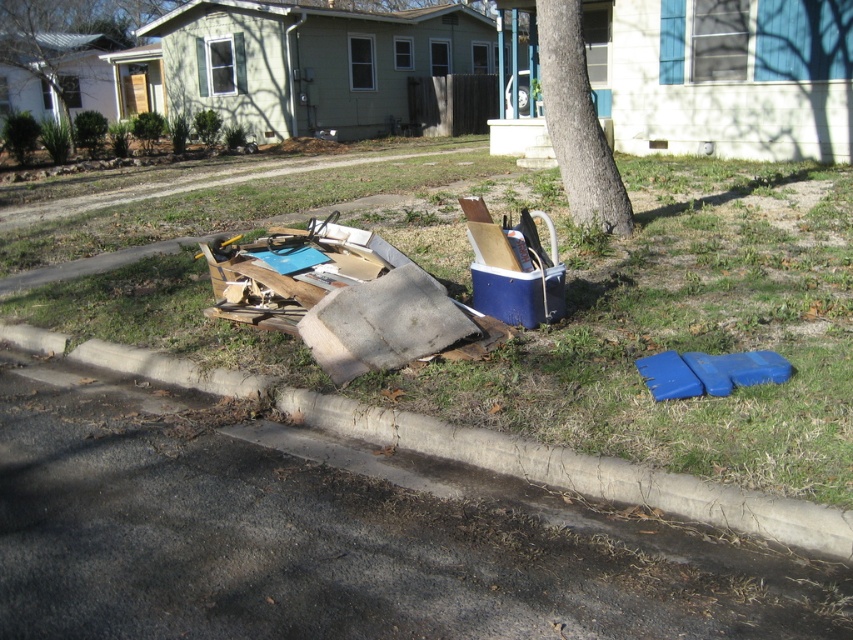
Question: Which point is closer to the camera?

Choices:
 (A) (544, 67)
 (B) (730, 161)
 (C) (125, 358)

Answer: (C)

Question: Does green grass at center have a larger size compared to concrete at lower left?

Choices:
 (A) yes
 (B) no

Answer: (A)

Question: Is concrete at lower left in front of brown rough bark tree at upper center?

Choices:
 (A) no
 (B) yes

Answer: (B)

Question: Which of the following is the closest to the observer?

Choices:
 (A) (787, 513)
 (B) (689, 412)

Answer: (A)

Question: Which object is the farthest from the concrete at lower left?

Choices:
 (A) green grass at center
 (B) brown rough bark tree at upper center

Answer: (B)

Question: Is green grass at center closer to the viewer compared to brown rough bark tree at upper center?

Choices:
 (A) yes
 (B) no

Answer: (A)